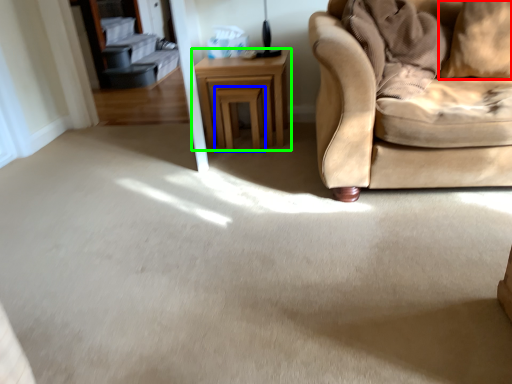
Question: Based on their relative distances, which object is farther from pillow (highlighted by a red box)? Choose from stool (highlighted by a blue box) and table (highlighted by a green box).

Choices:
 (A) stool
 (B) table

Answer: (A)